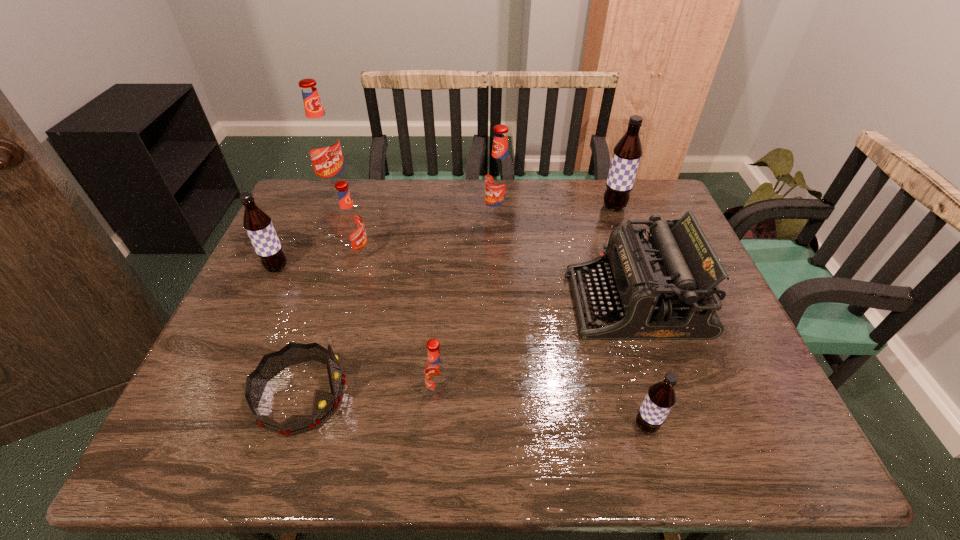
Where is `typewriter`? typewriter is located at coordinates (665, 287).

You are a GUI agent. You are given a task and a screenshot of the screen. Output one action in this format:
    pyautogui.click(x=<x>, y=<y>)
    Task: Click on the nearest brown root beer
    The width and height of the screenshot is (960, 540).
    Given the screenshot: What is the action you would take?
    point(661,396)

Find the location of a particular element. This screenshot has width=960, height=540. the second brown root beer from left to right is located at coordinates (661, 396).

In order to click on the smallest red root beer in this screenshot , I will do `click(436, 372)`.

Where is `the fourth root beer from left to right`? This screenshot has width=960, height=540. the fourth root beer from left to right is located at coordinates (436, 372).

I want to click on the shortest object, so click(324, 404).

In order to click on tiara in this screenshot , I will do `click(324, 404)`.

At what (x,y) coordinates should I click in order to perform the action: click on vacant region located on the front of the farthest object. Please return your answer as a coordinate pair (x, y). This screenshot has height=540, width=960. Looking at the image, I should click on (318, 231).

Where is `vacant area situated 0.270m on the front of the biggest brown root beer`? The image size is (960, 540). vacant area situated 0.270m on the front of the biggest brown root beer is located at coordinates (638, 275).

The height and width of the screenshot is (540, 960). In order to click on vacant region located 0.070m on the back of the second biggest red root beer in this screenshot , I will do `click(497, 197)`.